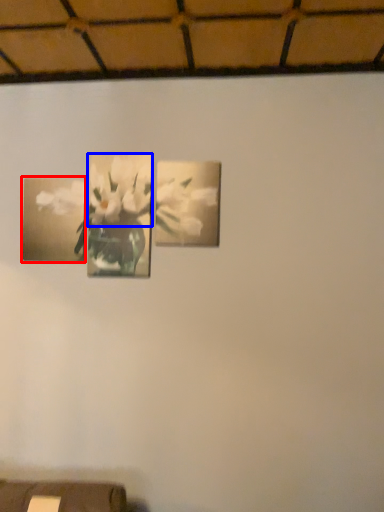
Question: Which object appears closest to the camera in this image, picture frame (highlighted by a red box) or flower (highlighted by a blue box)?

Choices:
 (A) picture frame
 (B) flower

Answer: (B)